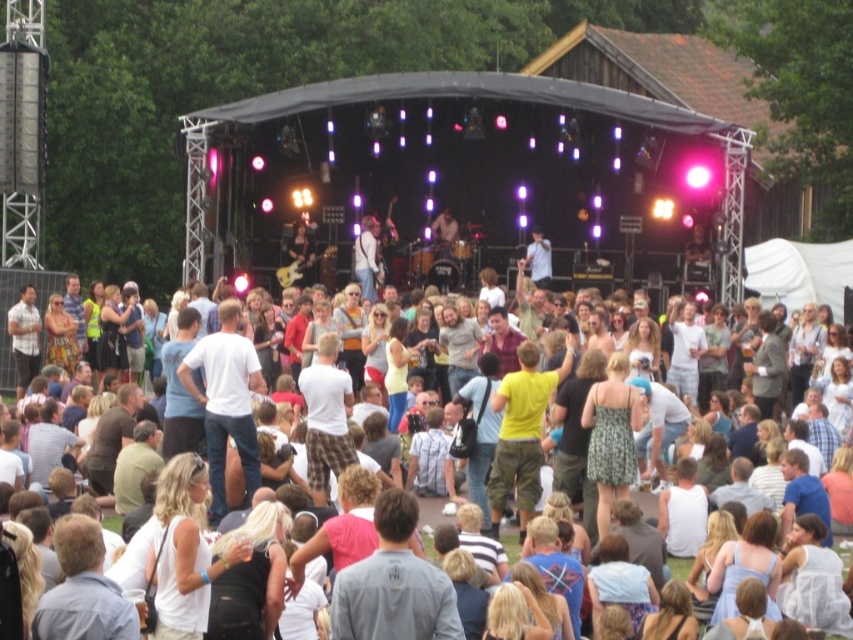
Question: Is the position of light brown leather jacket at center less distant than that of light brown leather guitar at center?

Choices:
 (A) no
 (B) yes

Answer: (B)

Question: Which object is positioned farthest from the white cotton shirt at center?

Choices:
 (A) light blue cotton shirt at center
 (B) light brown leather guitar at center

Answer: (B)

Question: Does white cotton shirt at center appear on the right side of light brown leather jacket at center?

Choices:
 (A) yes
 (B) no

Answer: (B)

Question: Which point is closer to the camera taking this photo?

Choices:
 (A) (15, 285)
 (B) (363, 243)

Answer: (A)

Question: Considering the relative positions of light blue cotton shirt at center and light brown leather guitar at center in the image provided, where is light blue cotton shirt at center located with respect to light brown leather guitar at center?

Choices:
 (A) left
 (B) right

Answer: (A)

Question: Which object appears farthest from the camera in this image?

Choices:
 (A) light brown leather guitar at center
 (B) white cotton shirt at center

Answer: (A)